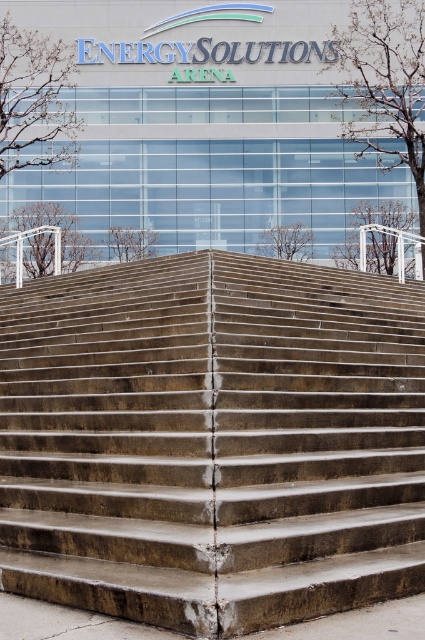
You are standing at the base of the stairs leading to the EnergySolutions Arena entrance. You see the concrete stairs at center and the concrete steps at lower center. Which set of stairs is positioned to the right when viewed from your perspective?

The concrete stairs at center are to the right of the concrete steps at lower center.